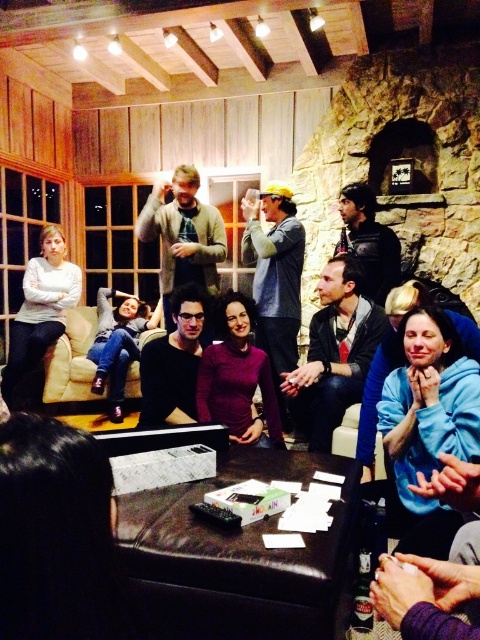
Question: Which of the following is the farthest from the observer?

Choices:
 (A) matte white sweater at left
 (B) black matte shirt at center

Answer: (A)

Question: Among these objects, which one is nearest to the camera?

Choices:
 (A) matte white sweater at left
 (B) knitted sweater at center
 (C) black leather jacket at center
 (D) black matte shirt at center

Answer: (D)

Question: Which of the following is the farthest from the observer?

Choices:
 (A) matte white sweater at left
 (B) black matte shirt at center
 (C) beige fabric couch at lower left

Answer: (C)

Question: Can you confirm if knitted sweater at center is wider than black matte shirt at center?

Choices:
 (A) no
 (B) yes

Answer: (B)

Question: In this image, where is black matte shirt at center located relative to beige fabric couch at lower left?

Choices:
 (A) below
 (B) above

Answer: (A)

Question: Is black leather jacket at center below beige fabric couch at lower left?

Choices:
 (A) yes
 (B) no

Answer: (A)